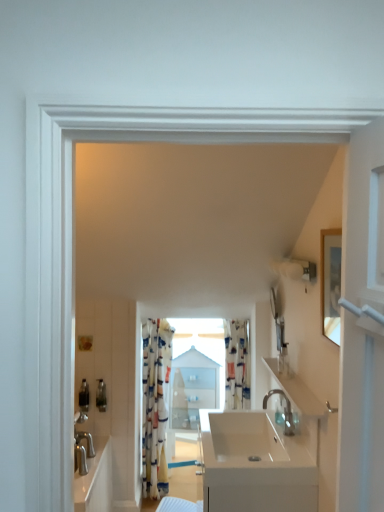
Question: From the image's perspective, is white glossy sink at center located above patterned fabric curtain at center, which ranks as the first curtain in left-to-right order?

Choices:
 (A) no
 (B) yes

Answer: (A)

Question: From the image's perspective, is white glossy sink at center located beneath patterned fabric curtain at center, placed as the 2th curtain when sorted from right to left?

Choices:
 (A) no
 (B) yes

Answer: (B)

Question: Can you confirm if white glossy sink at center is bigger than patterned fabric curtain at center, which ranks as the first curtain in left-to-right order?

Choices:
 (A) no
 (B) yes

Answer: (B)

Question: Can you confirm if white glossy sink at center is positioned to the left of patterned fabric curtain at center, which ranks as the first curtain in left-to-right order?

Choices:
 (A) yes
 (B) no

Answer: (B)

Question: Is white glossy sink at center not within patterned fabric curtain at center, placed as the 2th curtain when sorted from right to left?

Choices:
 (A) no
 (B) yes

Answer: (B)

Question: Would you say white glossy sink at center contains patterned fabric curtain at center, placed as the 2th curtain when sorted from right to left?

Choices:
 (A) yes
 (B) no

Answer: (B)

Question: Could you tell me if glossy white mirror at upper right is facing matte plastic soap dispenser at upper right, the second toiletry when ordered from bottom to top?

Choices:
 (A) yes
 (B) no

Answer: (B)

Question: Is there a large distance between glossy white mirror at upper right and matte plastic soap dispenser at upper right, the second toiletry when ordered from bottom to top?

Choices:
 (A) no
 (B) yes

Answer: (A)

Question: Can you confirm if glossy white mirror at upper right is bigger than matte plastic soap dispenser at upper right, the 1th toiletry in the right-to-left sequence?

Choices:
 (A) no
 (B) yes

Answer: (B)

Question: From the image's perspective, is glossy white mirror at upper right located beneath matte plastic soap dispenser at upper right, acting as the first toiletry starting from the front?

Choices:
 (A) yes
 (B) no

Answer: (B)

Question: Is glossy white mirror at upper right outside of matte plastic soap dispenser at upper right, the second toiletry in the back-to-front sequence?

Choices:
 (A) yes
 (B) no

Answer: (A)

Question: From a real-world perspective, is glossy white mirror at upper right on top of matte plastic soap dispenser at upper right, the second toiletry when ordered from bottom to top?

Choices:
 (A) no
 (B) yes

Answer: (B)

Question: Considering the relative positions of printed fabric curtain at center, placed as the 2th curtain when sorted from left to right, and matte plastic soap dispenser at upper right, the 1th toiletry in the right-to-left sequence, in the image provided, is printed fabric curtain at center, placed as the 2th curtain when sorted from left to right, to the right of matte plastic soap dispenser at upper right, the 1th toiletry in the right-to-left sequence, from the viewer's perspective?

Choices:
 (A) yes
 (B) no

Answer: (B)